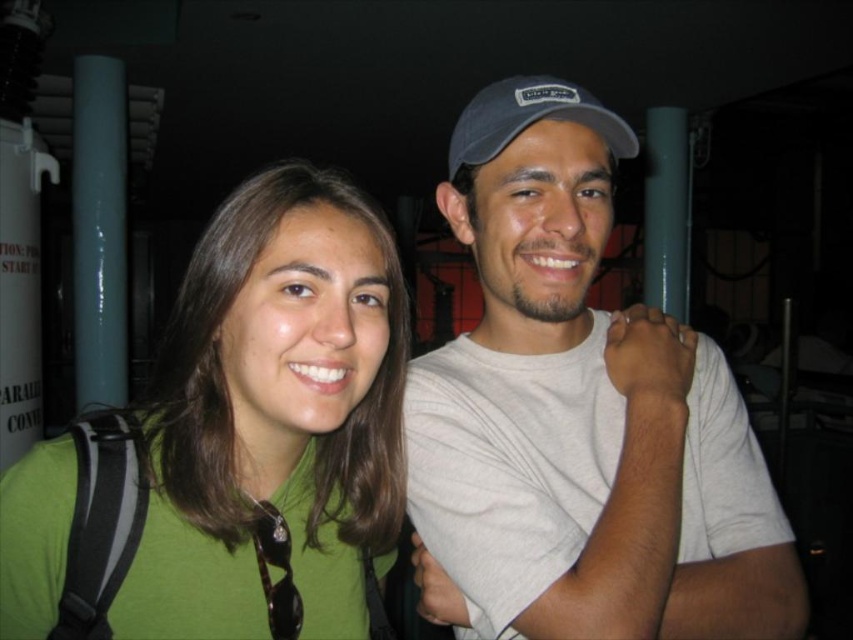
Question: Estimate the real-world distances between objects in this image. Which object is farther from the blue fabric baseball cap at upper center?

Choices:
 (A) green matte shirt at center
 (B) white matte t-shirt at center

Answer: (A)

Question: Estimate the real-world distances between objects in this image. Which object is farther from the white matte t-shirt at center?

Choices:
 (A) blue fabric baseball cap at upper center
 (B) green matte shirt at center

Answer: (A)

Question: Observing the image, what is the correct spatial positioning of white matte t-shirt at center in reference to blue fabric baseball cap at upper center?

Choices:
 (A) above
 (B) below

Answer: (B)

Question: Does white matte t-shirt at center appear over blue fabric baseball cap at upper center?

Choices:
 (A) no
 (B) yes

Answer: (A)

Question: Is green matte shirt at center to the right of blue fabric baseball cap at upper center from the viewer's perspective?

Choices:
 (A) yes
 (B) no

Answer: (B)

Question: Considering the real-world distances, which object is farthest from the blue fabric baseball cap at upper center?

Choices:
 (A) white matte t-shirt at center
 (B) green matte shirt at center

Answer: (B)